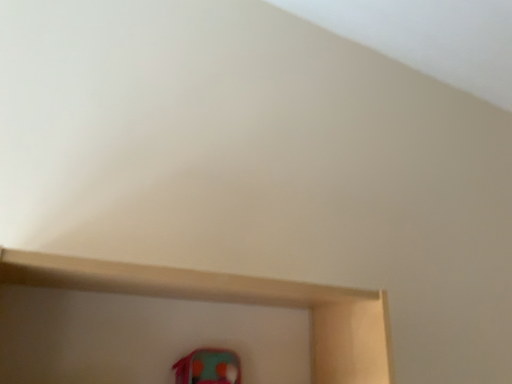
Where is `fuzzy felt shoe at lower center`? This screenshot has width=512, height=384. fuzzy felt shoe at lower center is located at coordinates (208, 367).

What do you see at coordinates (208, 367) in the screenshot?
I see `fuzzy felt shoe at lower center` at bounding box center [208, 367].

The width and height of the screenshot is (512, 384). I want to click on fuzzy felt shoe at lower center, so click(208, 367).